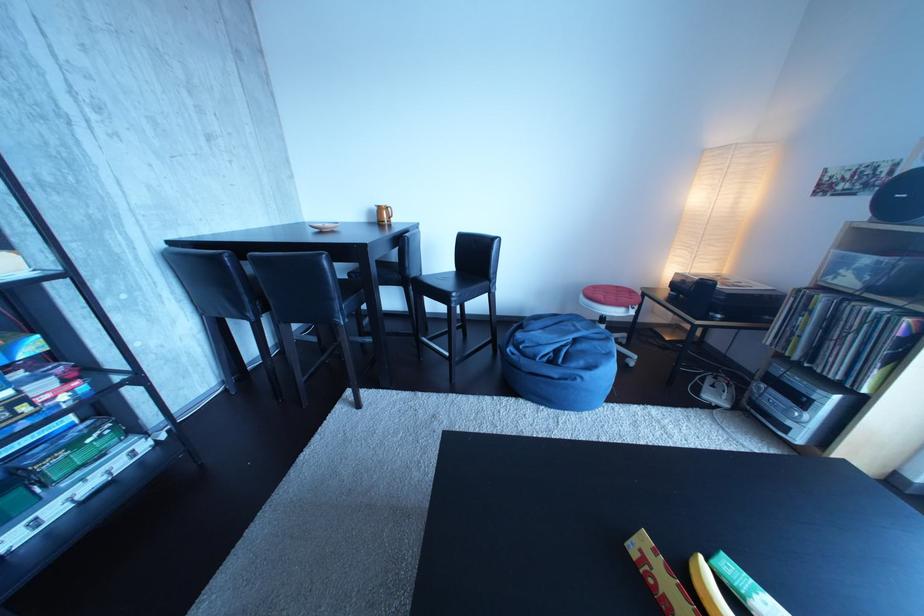
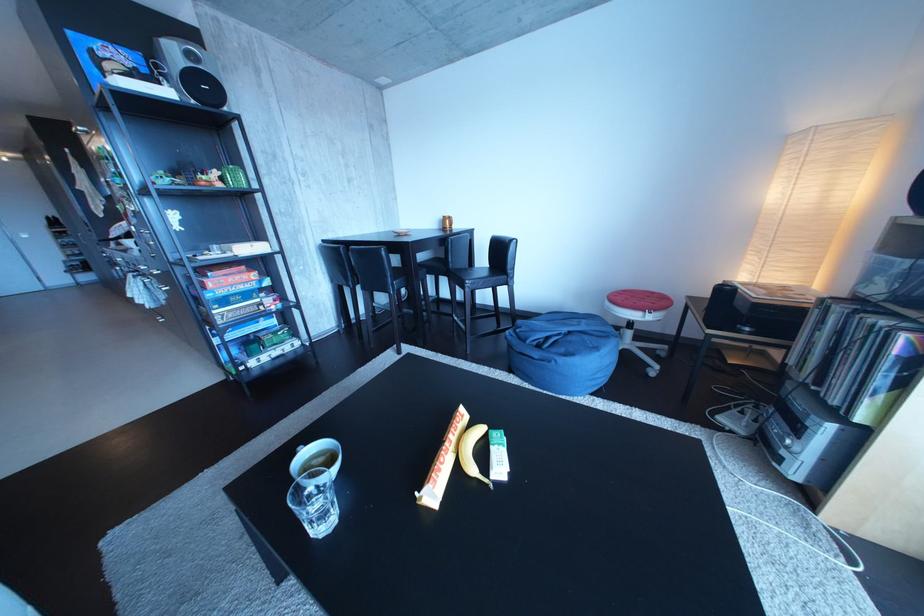
The point at (893, 315) is marked in the first image. Where is the corresponding point in the second image?

(896, 328)